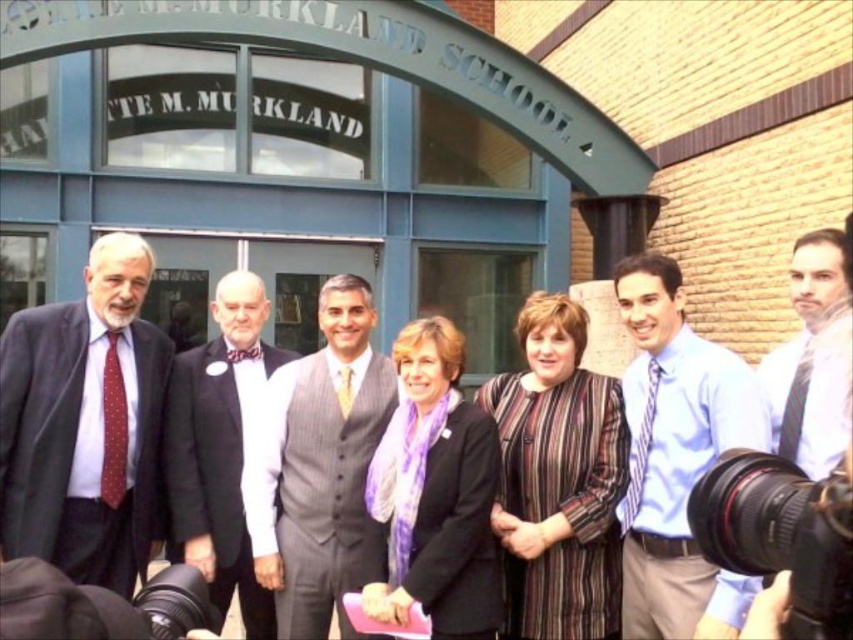
Based on the scene description and the coordinates provided, which object corresponds to the point labeled as point (84, 422)?

The point (84, 422) corresponds to the dark gray suit at left.

You are a photographer at the school event. You notice the dark gray suit at left and the black plastic video camera at lower left. Which object is closer to the camera in the photo?

The dark gray suit at left is closer to the camera because the black plastic video camera at lower left is behind it.